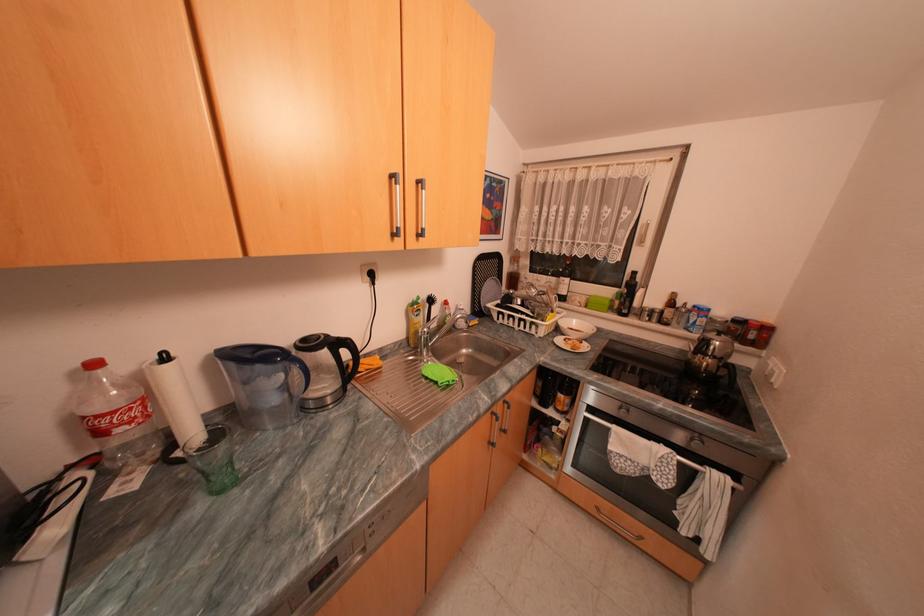
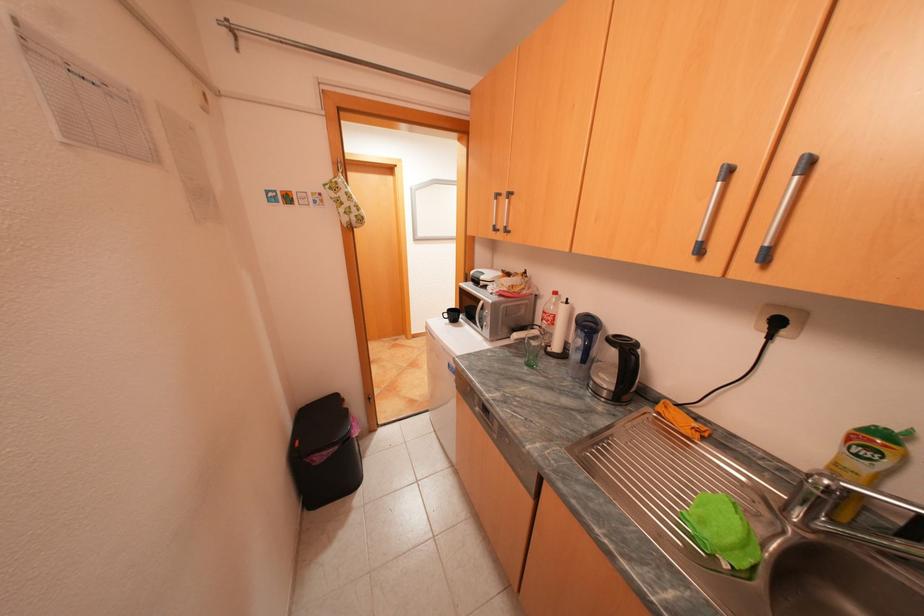
Find the pixel in the second image that matches (x=285, y=399) in the first image.

(586, 355)